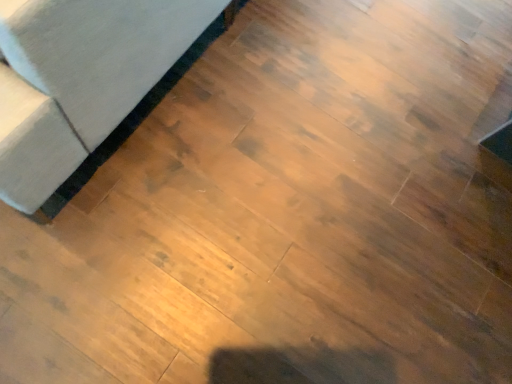
Where is `light gray fabric couch at left`? light gray fabric couch at left is located at coordinates (128, 124).

Measure the distance between light gray fabric couch at left and camera.

light gray fabric couch at left and camera are 1.21 meters apart.

What do you see at coordinates (128, 124) in the screenshot? Image resolution: width=512 pixels, height=384 pixels. I see `light gray fabric couch at left` at bounding box center [128, 124].

Where is `light gray fabric couch at left`? The image size is (512, 384). light gray fabric couch at left is located at coordinates (128, 124).